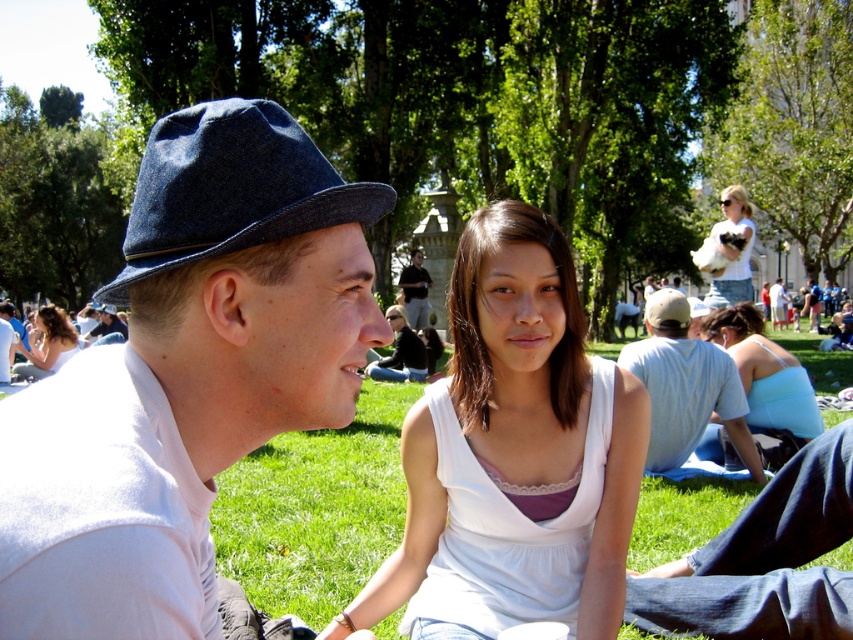
You are a photographer trying to capture a candid shot of the two people sitting on the grass. You notice the light blue fabric top at lower right and the dark blue denim jeans at center. Which clothing item would appear wider in your photo?

The light blue fabric top at lower right would appear wider in the photo since its width is larger than the dark blue denim jeans at center according to the description.

You are a photographer trying to capture a candid shot of the two people sitting on the grass. You want to ensure the denim fedora at left and dark blue denim jeans at center are both in frame. Based on their positions, which object should you focus on first to include both in your shot?

Since the denim fedora at left is to the left of dark blue denim jeans at center, you should focus on the denim fedora at left first to ensure both objects are captured in the frame.